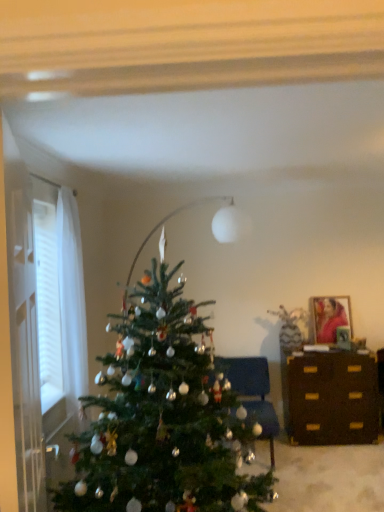
Question: Does matte wooden picture frame at upper right appear on the left side of dark brown wooden dresser at right?

Choices:
 (A) yes
 (B) no

Answer: (B)

Question: From a real-world perspective, is matte wooden picture frame at upper right located higher than dark brown wooden dresser at right?

Choices:
 (A) no
 (B) yes

Answer: (B)

Question: From the image's perspective, would you say matte wooden picture frame at upper right is shown under dark brown wooden dresser at right?

Choices:
 (A) yes
 (B) no

Answer: (B)

Question: Does matte wooden picture frame at upper right have a greater height compared to dark brown wooden dresser at right?

Choices:
 (A) no
 (B) yes

Answer: (A)

Question: Does matte wooden picture frame at upper right lie behind dark brown wooden dresser at right?

Choices:
 (A) yes
 (B) no

Answer: (A)

Question: From a real-world perspective, is white sheer curtain at left above or below velvet blue chair at center?

Choices:
 (A) below
 (B) above

Answer: (B)

Question: Is point tap(36, 269) closer or farther from the camera than point tap(243, 393)?

Choices:
 (A) closer
 (B) farther

Answer: (A)

Question: Is white sheer curtain at left to the left or to the right of velvet blue chair at center in the image?

Choices:
 (A) left
 (B) right

Answer: (A)

Question: From the image's perspective, is white sheer curtain at left located above or below velvet blue chair at center?

Choices:
 (A) below
 (B) above

Answer: (B)

Question: Based on their sizes in the image, would you say dark brown wooden dresser at right is bigger or smaller than velvet blue chair at center?

Choices:
 (A) big
 (B) small

Answer: (A)

Question: Would you say dark brown wooden dresser at right is to the left or to the right of velvet blue chair at center in the picture?

Choices:
 (A) right
 (B) left

Answer: (A)

Question: From the image's perspective, is dark brown wooden dresser at right above or below velvet blue chair at center?

Choices:
 (A) above
 (B) below

Answer: (B)

Question: From a real-world perspective, is dark brown wooden dresser at right above or below velvet blue chair at center?

Choices:
 (A) below
 (B) above

Answer: (A)

Question: Do you think white sheer curtain at left is within dark brown wooden dresser at right, or outside of it?

Choices:
 (A) inside
 (B) outside

Answer: (B)

Question: In terms of height, does white sheer curtain at left look taller or shorter compared to dark brown wooden dresser at right?

Choices:
 (A) short
 (B) tall

Answer: (B)